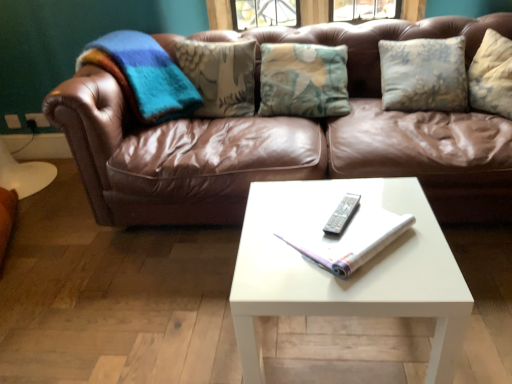
Image resolution: width=512 pixels, height=384 pixels. Identify the location of free location to the right of silver metallic remote at center. (373, 217).